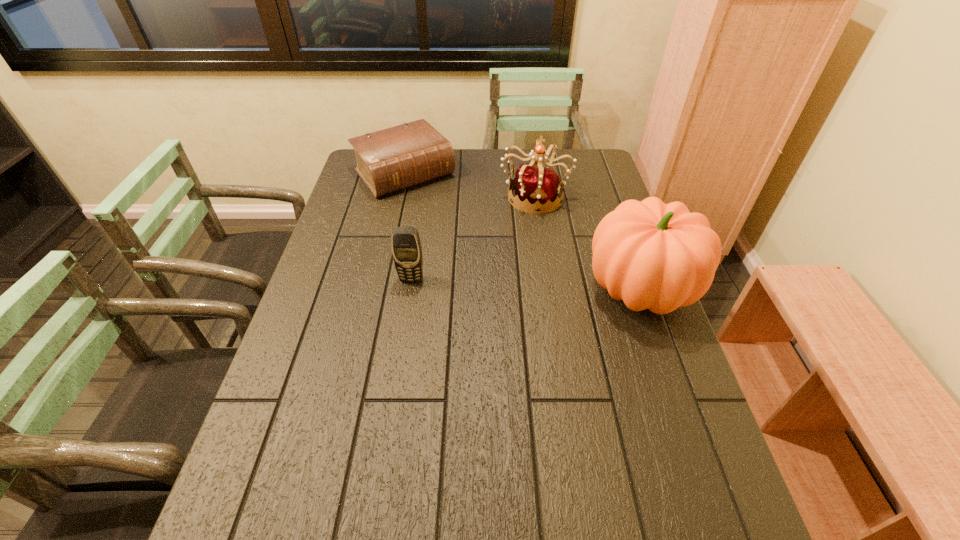
The image size is (960, 540). Identify the location of free point between the pumpkin and the shortest object. (522, 231).

You are a GUI agent. You are given a task and a screenshot of the screen. Output one action in this format:
    pyautogui.click(x=<x>, y=<y>)
    Task: Click on the empty space that is in between the pumpkin and the cellular telephone
    The width and height of the screenshot is (960, 540).
    Given the screenshot: What is the action you would take?
    pyautogui.click(x=525, y=285)

Locate an element on the screen. unoccupied position between the pumpkin and the tiara is located at coordinates pyautogui.click(x=587, y=242).

You are a GUI agent. You are given a task and a screenshot of the screen. Output one action in this format:
    pyautogui.click(x=<x>, y=<y>)
    Task: Click on the object that is the second closest to the tiara
    Image resolution: width=960 pixels, height=540 pixels.
    Given the screenshot: What is the action you would take?
    pyautogui.click(x=652, y=255)

The height and width of the screenshot is (540, 960). I want to click on object that is the second nearest to the pumpkin, so click(x=406, y=247).

The width and height of the screenshot is (960, 540). Identify the location of vacant area in the image that satisfies the following two spatial constraints: 1. on the front side of the second tallest object; 2. on the right side of the pumpkin. (549, 289).

Identify the location of free space that satisfies the following two spatial constraints: 1. on the front side of the shortest object; 2. on the right side of the pumpkin. (378, 289).